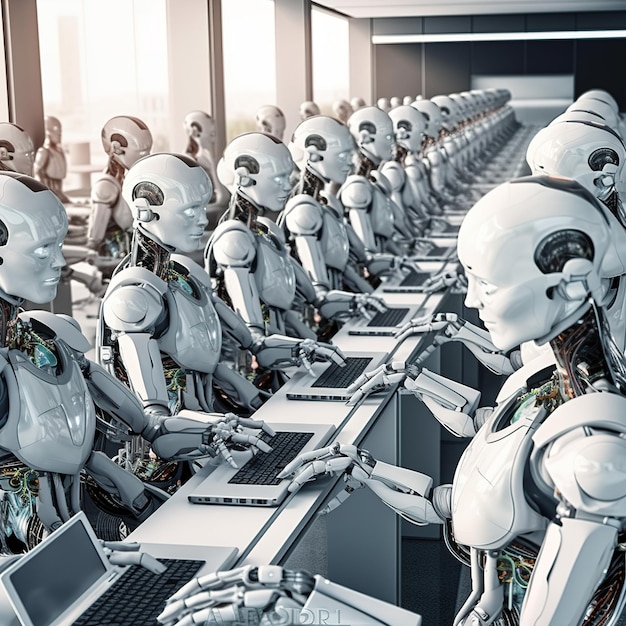
In order to click on windows in this screenshot , I will do `click(335, 69)`, `click(250, 59)`, `click(131, 66)`, `click(3, 108)`.